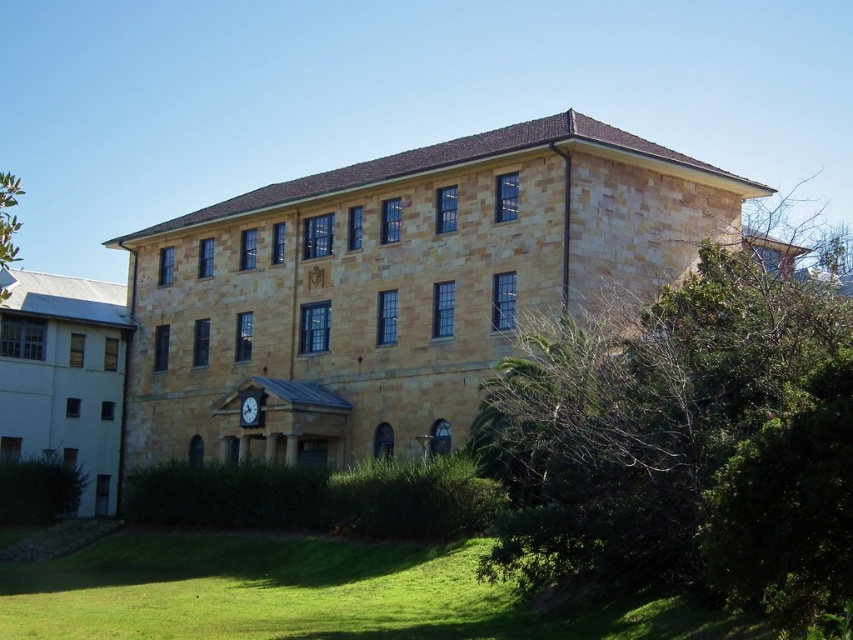
You are standing in front of the building and want to place a small garden statue between the green leafy bush at lower right and the green leafy tree at upper left. Which side of the statue should face the smaller plant?

The green leafy bush at lower right is smaller than the green leafy tree at upper left, so the statue should face the green leafy bush at lower right.

You are standing in front of the two story building and looking at the two points marked on the image. Which point is closer to you, point [3,266] or point [252,403]?

Point [252,403] is closer to you because point [3,266] is behind it.